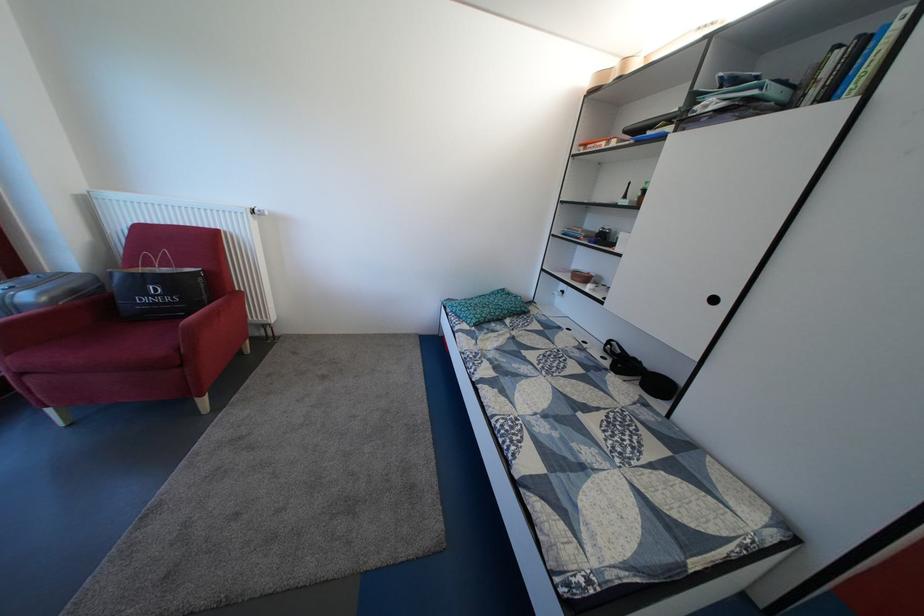
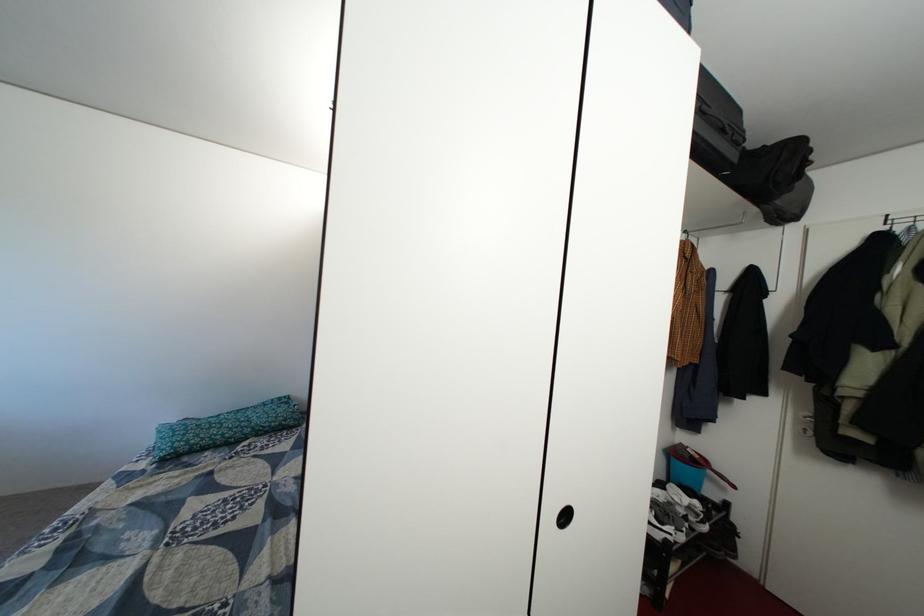
Question: The images are taken continuously from a first-person perspective. In which direction are you moving?

Choices:
 (A) Left
 (B) Right
 (C) Forward
 (D) Backward

Answer: (B)